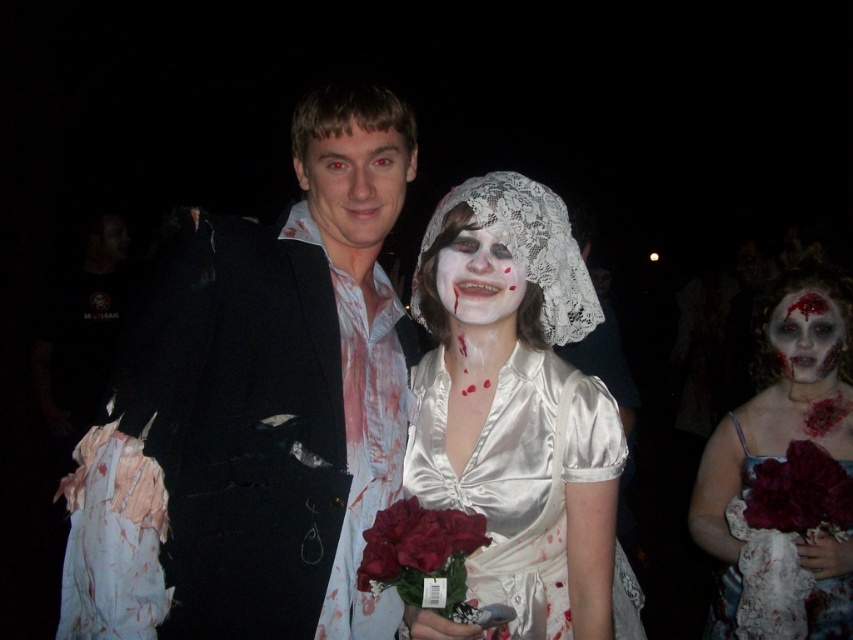
Is point (433, 477) less distant than point (775, 460)?

Yes, point (433, 477) is in front of point (775, 460).

You are a GUI agent. You are given a task and a screenshot of the screen. Output one action in this format:
    pyautogui.click(x=<x>, y=<y>)
    Task: Click on the satin dress at center
    
    Given the screenshot: What is the action you would take?
    pyautogui.click(x=517, y=417)

You are a GUI agent. You are given a task and a screenshot of the screen. Output one action in this format:
    pyautogui.click(x=<x>, y=<y>)
    Task: Click on the satin dress at center
    This screenshot has height=640, width=853.
    Given the screenshot: What is the action you would take?
    pyautogui.click(x=517, y=417)

Where is `white lace veil at upper center`? This screenshot has width=853, height=640. white lace veil at upper center is located at coordinates (776, 413).

Can you confirm if satin dress at center is thinner than white matte lace veil at center?

No, satin dress at center is not thinner than white matte lace veil at center.

Between satin dress at center and white matte lace veil at center, which one is positioned lower?

satin dress at center

Between point (527, 298) and point (451, 316), which one is positioned in front?

Point (451, 316)

Image resolution: width=853 pixels, height=640 pixels. In order to click on satin dress at center in this screenshot , I will do `click(517, 417)`.